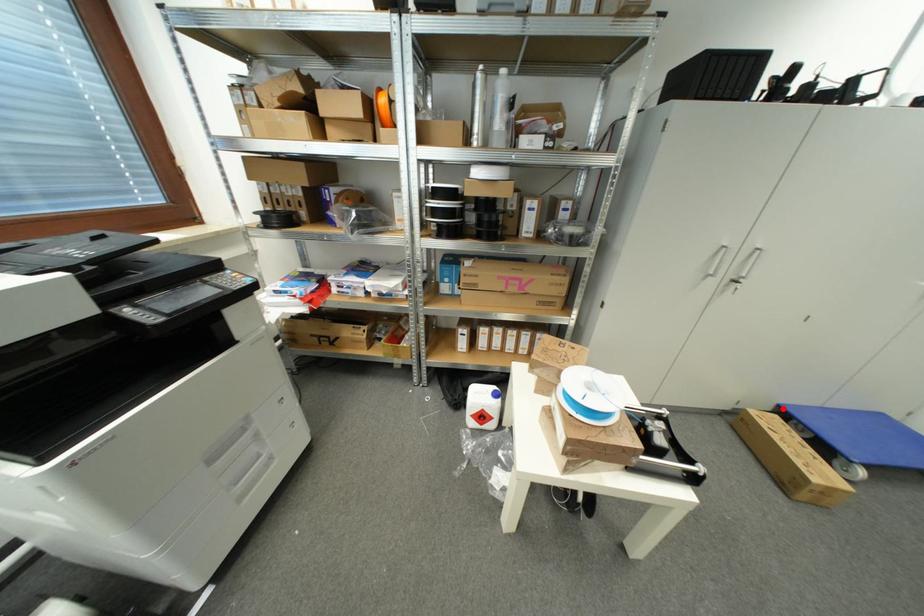
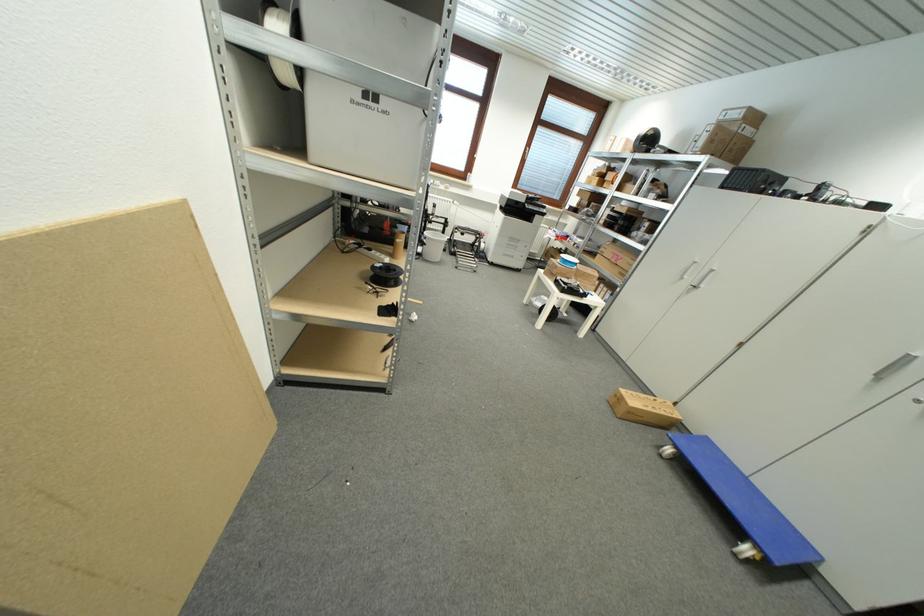
Question: I am providing you with two images of the same scene from different viewpoints. A red point is marked on the first image. At the location where the point appears in image 1, is it still visible in image 2?

Choices:
 (A) Yes
 (B) No

Answer: (A)